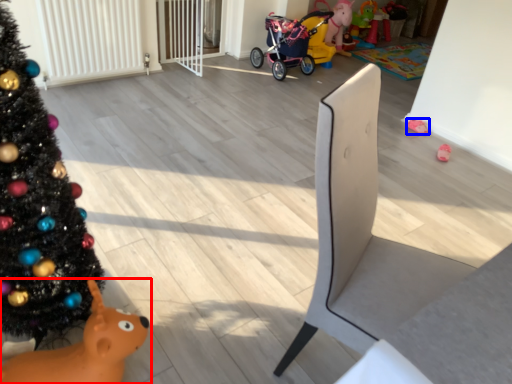
Question: Which of the following is the farthest to the observer, toy (highlighted by a red box) or toy (highlighted by a blue box)?

Choices:
 (A) toy
 (B) toy

Answer: (B)